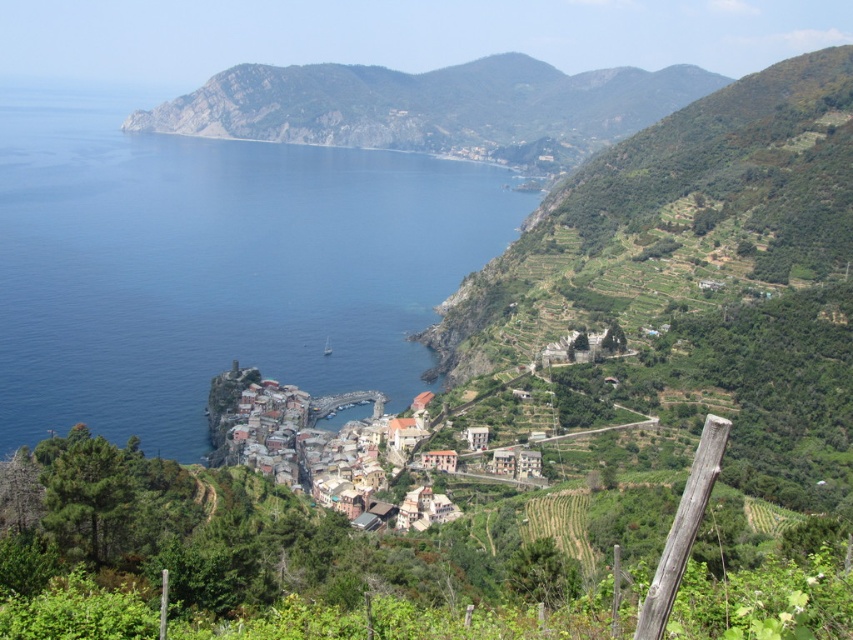
Which of these two, blue water at center or green rocky mountain at upper center, stands taller?

blue water at center is taller.

Is blue water at center further to the viewer compared to green rocky mountain at upper center?

No, it is not.

Does point (171, 356) lie in front of point (389, 76)?

Yes.

Find the location of a particular element. The image size is (853, 640). blue water at center is located at coordinates pos(215,266).

Is green rocky mountain at upper center taller than terracotta clay houses at center?

Yes.

Who is more forward, (593, 81) or (268, 413)?

Positioned in front is point (268, 413).

Does point (401, 100) come behind point (238, 401)?

Yes, it is behind point (238, 401).

Where is `green rocky mountain at upper center`? green rocky mountain at upper center is located at coordinates (434, 108).

Between point (53, 104) and point (282, 429), which one is positioned behind?

Point (53, 104)

Is blue water at center bigger than terracotta clay houses at center?

Yes, blue water at center is bigger than terracotta clay houses at center.

Is point (213, 339) behind point (244, 412)?

Yes, point (213, 339) is farther from viewer.

The width and height of the screenshot is (853, 640). I want to click on blue water at center, so click(215, 266).